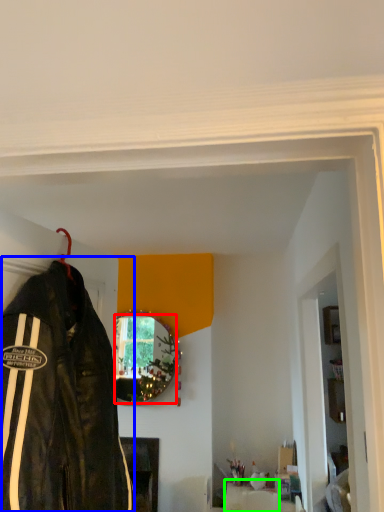
Question: Which object is the closest to the mirror (highlighted by a red box)? Choose among these: jacket (highlighted by a blue box) or furniture (highlighted by a green box).

Choices:
 (A) jacket
 (B) furniture

Answer: (B)